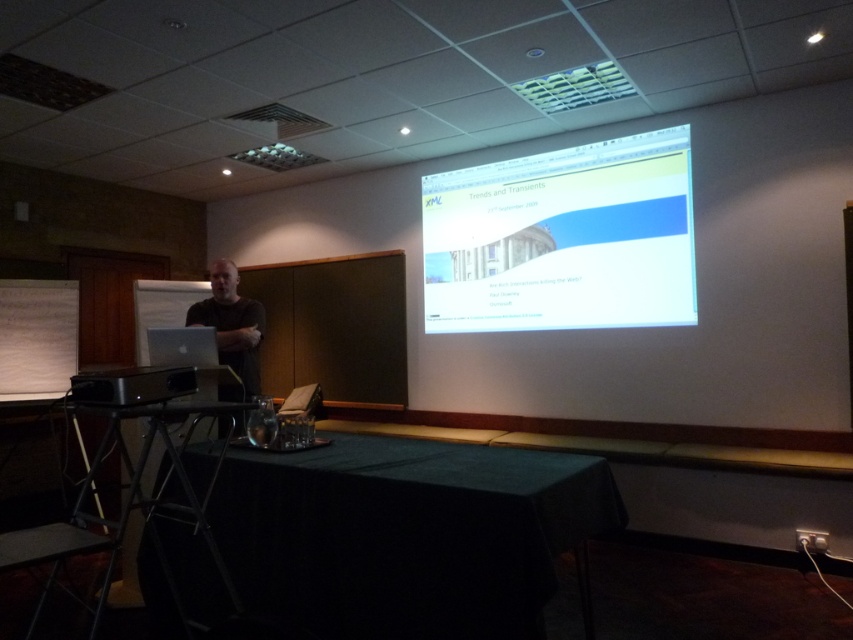
Question: Estimate the real-world distances between objects in this image. Which object is farther from the black plastic projector at lower left?

Choices:
 (A) black matte shirt at center
 (B) black fabric table at lower center
 (C) white glossy projector screen at upper center

Answer: (C)

Question: Which point appears closest to the camera in this image?

Choices:
 (A) (688, 262)
 (B) (173, 508)
 (C) (236, 586)

Answer: (B)

Question: Which point is farther to the camera?

Choices:
 (A) (560, 218)
 (B) (178, 502)

Answer: (A)

Question: Is white glossy projector screen at upper center in front of black matte shirt at center?

Choices:
 (A) yes
 (B) no

Answer: (B)

Question: Can you confirm if black matte shirt at center is positioned to the right of black plastic projector at lower left?

Choices:
 (A) no
 (B) yes

Answer: (A)

Question: Does white glossy projector screen at upper center appear under black matte shirt at center?

Choices:
 (A) no
 (B) yes

Answer: (A)